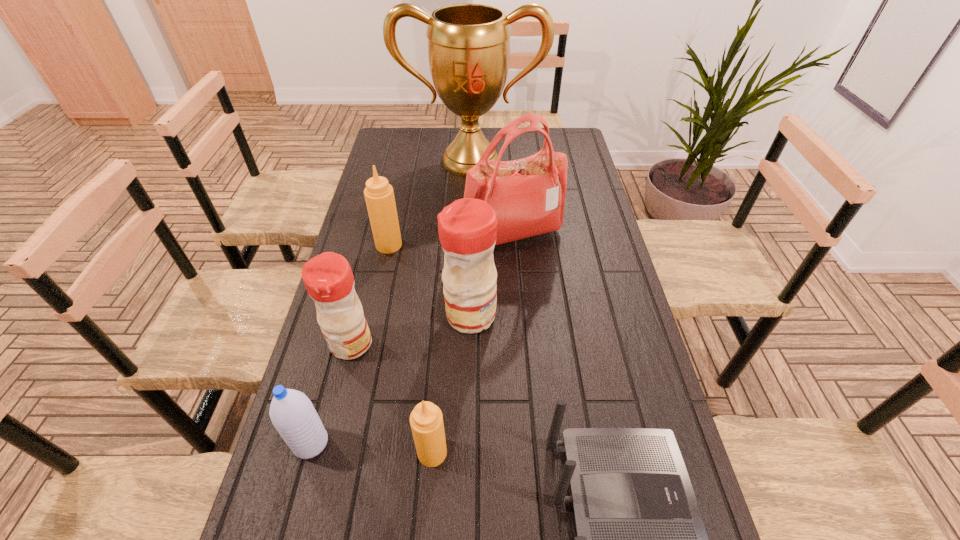
Image resolution: width=960 pixels, height=540 pixels. I want to click on the tallest object, so click(x=468, y=44).

Locate an element on the screen. the farthest object is located at coordinates (468, 44).

In order to click on the second tallest object in this screenshot , I will do `click(528, 195)`.

You are a GUI agent. You are given a task and a screenshot of the screen. Output one action in this format:
    pyautogui.click(x=<x>, y=<y>)
    Task: Click on the red handbag
    The height and width of the screenshot is (540, 960).
    Given the screenshot: What is the action you would take?
    pyautogui.click(x=528, y=195)

Identify the location of the right red condiment. The width and height of the screenshot is (960, 540). (467, 228).

The height and width of the screenshot is (540, 960). I want to click on the bigger red condiment, so pos(467,228).

Locate an element on the screen. The width and height of the screenshot is (960, 540). the left tan condiment is located at coordinates point(379,195).

Identify the location of the farther tan condiment. (379, 195).

Identify the location of the smaller red condiment. Image resolution: width=960 pixels, height=540 pixels. (328, 278).

Where is `water bottle`? water bottle is located at coordinates (292, 413).